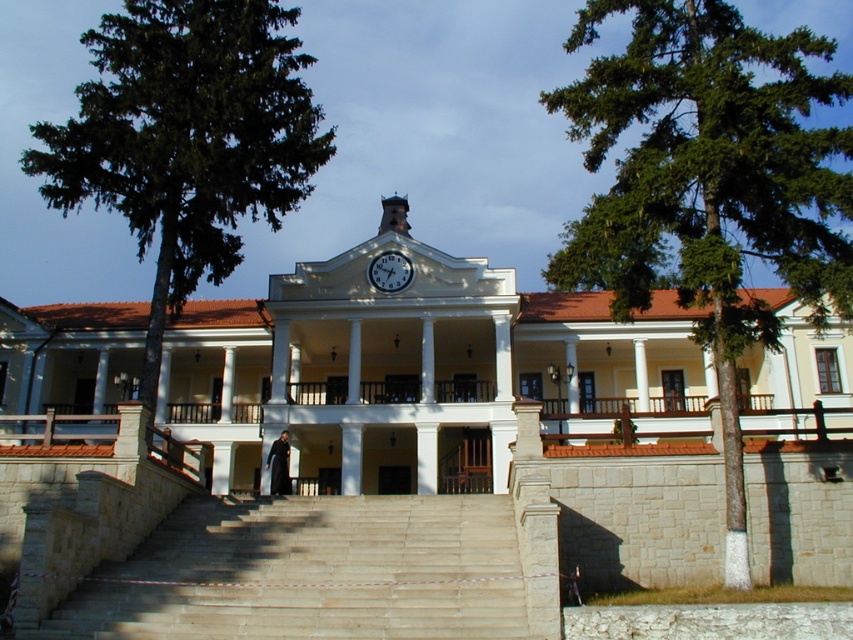
Can you confirm if light beige stone stairs at center is thinner than white glossy clock at center?

Incorrect, light beige stone stairs at center's width is not less than white glossy clock at center's.

Which is behind, point (477, 616) or point (378, 284)?

Point (378, 284)

Which is behind, point (267, 564) or point (393, 289)?

Point (393, 289)

Identify the location of light beige stone stairs at center. (310, 572).

Is green leafy tree at left further to camera compared to white glossy clock at center?

No, it is not.

Measure the distance from green leafy tree at left to white glossy clock at center.

A distance of 28.37 meters exists between green leafy tree at left and white glossy clock at center.

Which is behind, point (160, 246) or point (386, 269)?

Point (386, 269)

Where is `green leafy tree at left`? This screenshot has width=853, height=640. green leafy tree at left is located at coordinates (186, 138).

This screenshot has width=853, height=640. I want to click on green leafy tree at center, so (709, 186).

Which is in front, point (579, 100) or point (383, 252)?

Positioned in front is point (579, 100).

Where is `green leafy tree at center`? This screenshot has height=640, width=853. green leafy tree at center is located at coordinates coord(709,186).